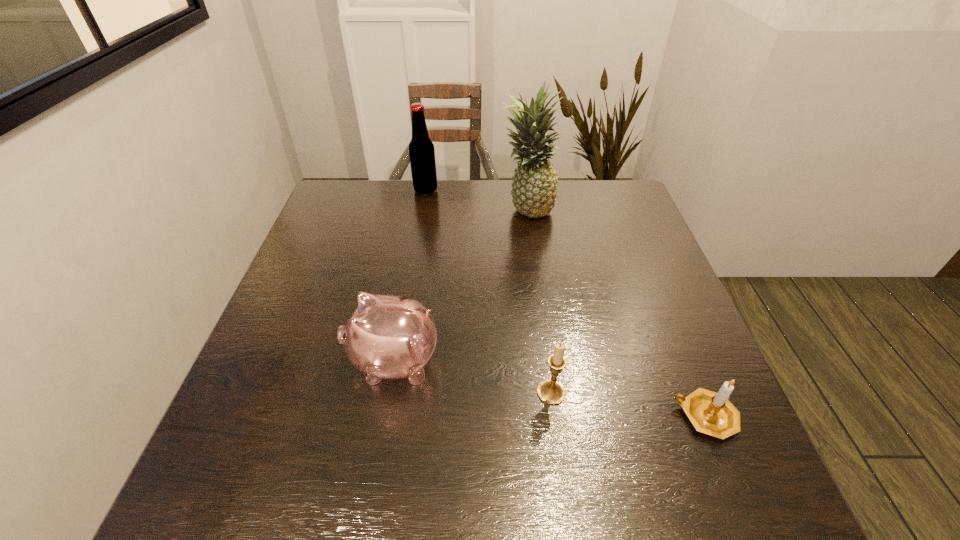
Locate an element on the screen. vacant space situated on the front facing side of the piggy bank is located at coordinates (257, 362).

What are the coordinates of `free space located on the left of the left candle holder` in the screenshot? It's located at (492, 392).

Locate an element on the screen. Image resolution: width=960 pixels, height=540 pixels. vacant space located on the back of the shortest object is located at coordinates (660, 304).

This screenshot has height=540, width=960. Identify the location of pineapple situated at the far edge. (534, 191).

Find the location of a particular element. beer bottle at the far edge is located at coordinates (421, 149).

At what (x,y) coordinates should I click in order to perform the action: click on object located in the right edge section of the desktop. Please return your answer as a coordinate pair (x, y). This screenshot has height=540, width=960. Looking at the image, I should click on (711, 413).

Where is `free space at the far edge of the desktop`? free space at the far edge of the desktop is located at coordinates (437, 202).

Image resolution: width=960 pixels, height=540 pixels. In the image, there is a desktop. What are the coordinates of `vacant area at the near edge` in the screenshot? It's located at (390, 481).

Find the location of a particular element. The height and width of the screenshot is (540, 960). vacant area at the right edge is located at coordinates (708, 378).

The height and width of the screenshot is (540, 960). I want to click on vacant area at the far left corner, so click(368, 191).